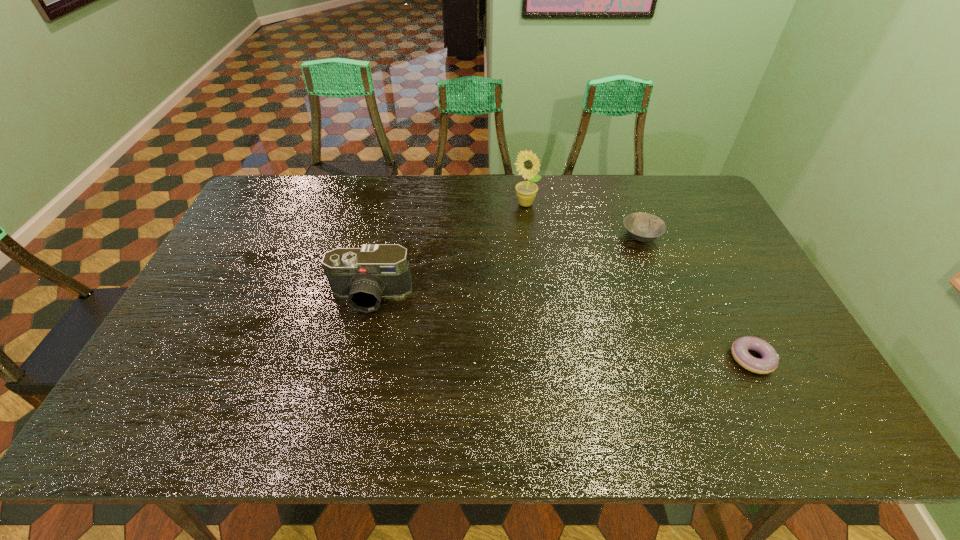
Locate an element on the screen. This screenshot has height=540, width=960. free space that is in between the third shortest object and the third object from left to right is located at coordinates (506, 266).

Where is `free point between the sunflower and the third nearest object`? free point between the sunflower and the third nearest object is located at coordinates (583, 220).

In order to click on vacant space that is in between the bowl and the rightmost object in this screenshot , I will do `click(696, 297)`.

The image size is (960, 540). What are the coordinates of `free space between the sunflower and the third tallest object` in the screenshot? It's located at (583, 220).

I want to click on free point between the sunflower and the second tallest object, so click(x=447, y=249).

This screenshot has width=960, height=540. In order to click on vacant space in between the rightmost object and the leftmost object in this screenshot , I will do `click(562, 327)`.

Locate an element on the screen. Image resolution: width=960 pixels, height=540 pixels. vacant space that is in between the second farthest object and the camera is located at coordinates (506, 266).

You are a GUI agent. You are given a task and a screenshot of the screen. Output one action in this format:
    pyautogui.click(x=<x>, y=<y>)
    Task: Click on the free space between the camera and the second object from left to right
    
    Given the screenshot: What is the action you would take?
    pyautogui.click(x=447, y=249)

Where is `vacant area that lies between the second farthest object and the leftmost object`? vacant area that lies between the second farthest object and the leftmost object is located at coordinates (506, 266).

This screenshot has height=540, width=960. I want to click on object that stands as the second closest to the shortest object, so click(527, 164).